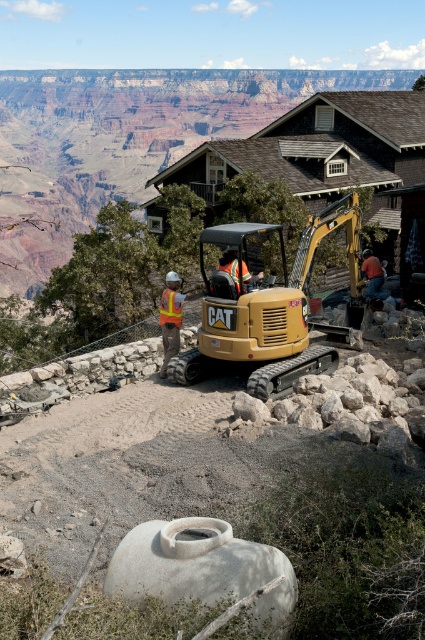
Question: Which object is closer to the camera taking this photo?

Choices:
 (A) reflective yellow safety vest at center
 (B) matte yellow excavator at center
 (C) orange reflective safety vest at center

Answer: (B)

Question: Can you confirm if reflective orange vest at center is positioned to the right of orange reflective vest at center?

Choices:
 (A) no
 (B) yes

Answer: (A)

Question: Which object is positioned farthest from the orange reflective safety vest at center?

Choices:
 (A) reflective orange vest at center
 (B) matte yellow excavator at center
 (C) reflective yellow safety vest at center
 (D) orange reflective vest at center

Answer: (D)

Question: Can you confirm if reflective orange vest at center is smaller than reflective yellow safety vest at center?

Choices:
 (A) yes
 (B) no

Answer: (B)

Question: Does orange reflective vest at center have a smaller size compared to orange reflective safety vest at center?

Choices:
 (A) yes
 (B) no

Answer: (B)

Question: Which of the following is the farthest from the observer?

Choices:
 (A) matte yellow excavator at center
 (B) orange reflective safety vest at center
 (C) reflective orange vest at center

Answer: (C)